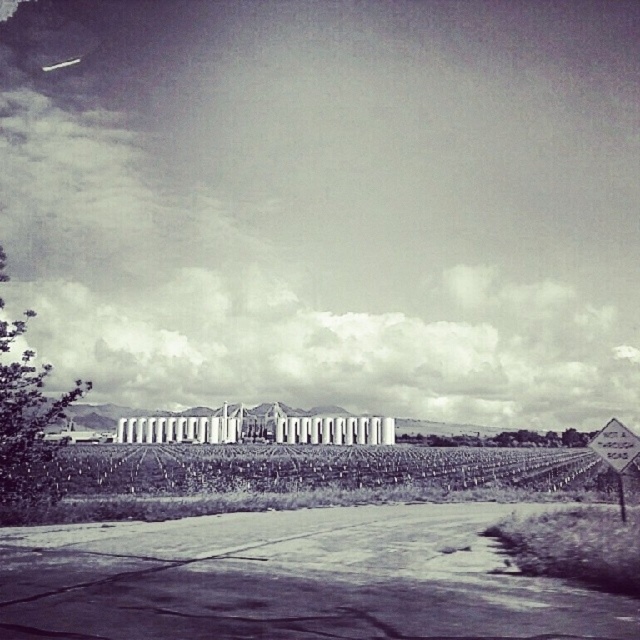
You are standing at the starting point of the road in the foreground and want to reach the green grassy vineyard at center. Which direction should you walk to get there?

The green grassy vineyard at center is located at point [301,477], so you should walk forward along the road towards the midground where the vineyard is situated.